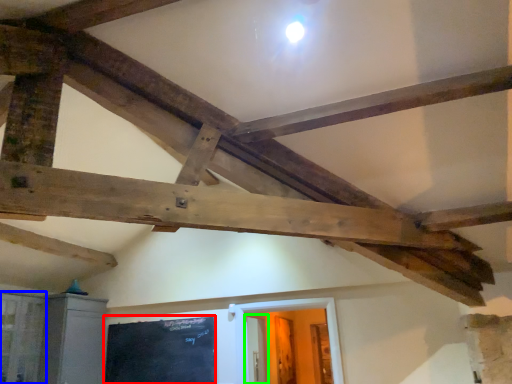
Question: Which object is the closest to the bulletin board (highlighted by a red box)? Choose among these: window (highlighted by a blue box) or door (highlighted by a green box).

Choices:
 (A) window
 (B) door

Answer: (A)